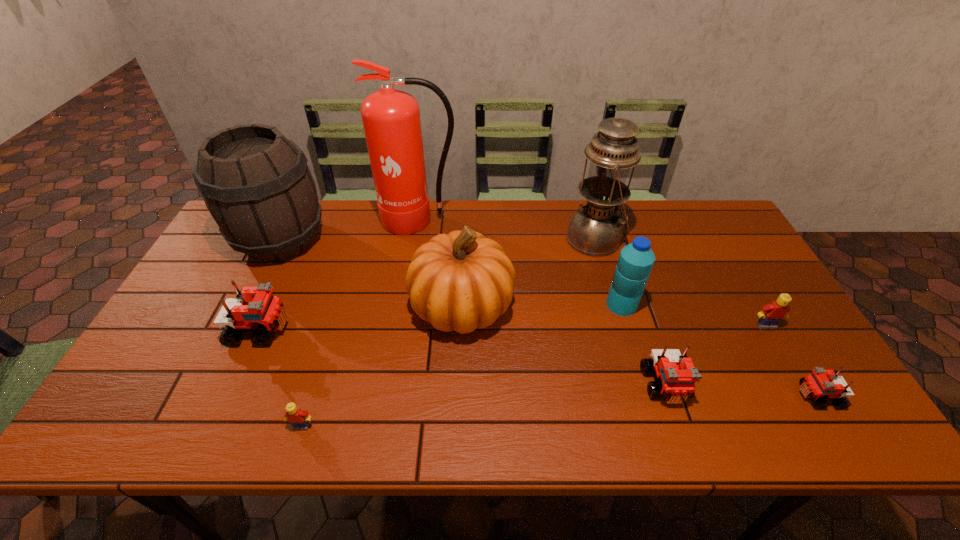
You are a GUI agent. You are given a task and a screenshot of the screen. Output one action in this format:
    pyautogui.click(x=<x>, y=<y>)
    Task: Click on the fire extinguisher
    
    Given the screenshot: What is the action you would take?
    pyautogui.click(x=391, y=120)

I want to click on red fire extinguisher, so click(391, 120).

At what (x,y) coordinates should I click in order to perform the action: click on oil lamp. Please return your answer as a coordinate pair (x, y). Looking at the image, I should click on (595, 229).

At what (x,y) coordinates should I click in order to perform the action: click on the eighth shortest object. Please return your answer as a coordinate pair (x, y). Looking at the image, I should click on (256, 184).

This screenshot has height=540, width=960. Find the location of `pumpkin`. pumpkin is located at coordinates (x=460, y=281).

Identify the location of blue water bottle. (636, 260).

Locate an element on the screen. This screenshot has width=960, height=540. the leftmost Lego is located at coordinates (255, 309).

Find the location of a particular element. The height and width of the screenshot is (540, 960). the fifth shortest object is located at coordinates (255, 309).

Find the location of a particular element. This screenshot has height=540, width=960. the right yellow Lego is located at coordinates (771, 314).

Find the location of a particular element. the bigger yellow Lego is located at coordinates (771, 314).